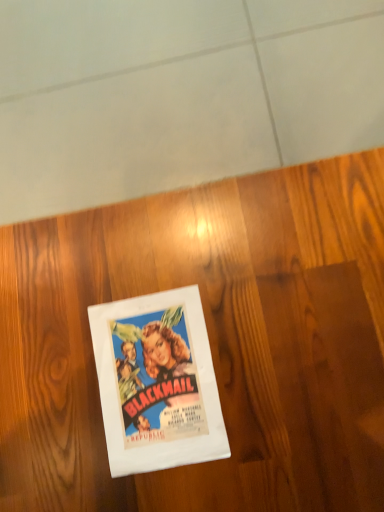
Question: Should I look upward or downward to see wooden at center?

Choices:
 (A) up
 (B) down

Answer: (A)

Question: Is wooden at center wider than white paper at center?

Choices:
 (A) no
 (B) yes

Answer: (B)

Question: Is wooden at center not within white paper at center?

Choices:
 (A) no
 (B) yes

Answer: (B)

Question: Can white paper at center be found inside wooden at center?

Choices:
 (A) yes
 (B) no

Answer: (A)

Question: Does wooden at center have a greater height compared to white paper at center?

Choices:
 (A) yes
 (B) no

Answer: (A)

Question: Is the position of wooden at center less distant than that of white paper at center?

Choices:
 (A) no
 (B) yes

Answer: (B)

Question: Considering the relative sizes of wooden at center and white paper at center in the image provided, is wooden at center bigger than white paper at center?

Choices:
 (A) no
 (B) yes

Answer: (B)

Question: Does white paper at center turn towards wooden at center?

Choices:
 (A) no
 (B) yes

Answer: (B)

Question: Is white paper at center with wooden at center?

Choices:
 (A) yes
 (B) no

Answer: (B)

Question: Is white paper at center closer to camera compared to wooden at center?

Choices:
 (A) no
 (B) yes

Answer: (A)

Question: Considering the relative sizes of white paper at center and wooden at center in the image provided, is white paper at center shorter than wooden at center?

Choices:
 (A) no
 (B) yes

Answer: (B)

Question: Is white paper at center not inside wooden at center?

Choices:
 (A) no
 (B) yes

Answer: (A)

Question: Is white paper at center turned away from wooden at center?

Choices:
 (A) no
 (B) yes

Answer: (B)

Question: Visually, is white paper at center positioned to the left or to the right of wooden at center?

Choices:
 (A) right
 (B) left

Answer: (B)